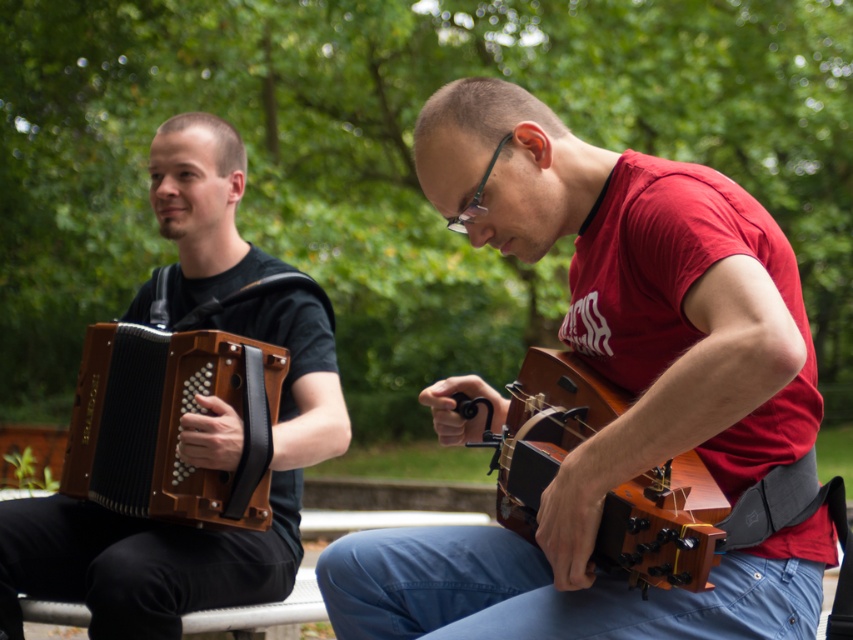
Is point (296, 300) closer to viewer compared to point (216, 472)?

No, it is not.

Between point (166, 593) and point (161, 452), which one is positioned in front?

Point (166, 593)

Find the location of a particular element. The width and height of the screenshot is (853, 640). matte brown accordion at left is located at coordinates (271, 429).

Is matte brown accordion at left taller than wooden guitar at center?

Yes.

Which is behind, point (90, 506) or point (555, 397)?

Point (90, 506)

The height and width of the screenshot is (640, 853). What are the coordinates of `matte brown accordion at left` in the screenshot? It's located at (271, 429).

Who is higher up, wooden guitar at center or brown wooden accordion at left?

brown wooden accordion at left

Is point (497, 477) less distant than point (178, 352)?

That is True.

What do you see at coordinates (544, 428) in the screenshot? The width and height of the screenshot is (853, 640). I see `wooden guitar at center` at bounding box center [544, 428].

This screenshot has width=853, height=640. I want to click on wooden guitar at center, so click(544, 428).